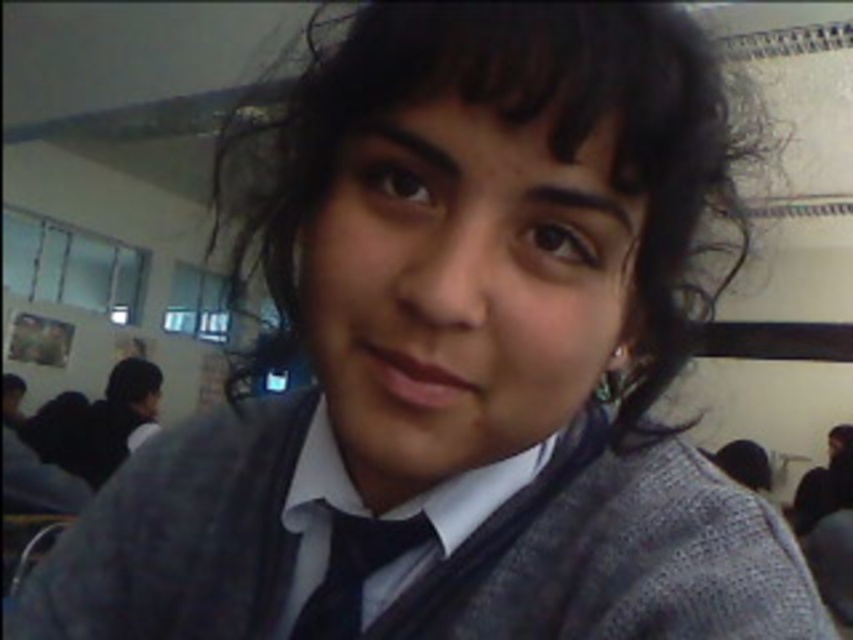
Question: Which object appears closest to the camera in this image?

Choices:
 (A) black satin tie at center
 (B) dark brown silky hair at center
 (C) matte gray sweater at center

Answer: (B)

Question: Which point is closer to the camera taking this photo?

Choices:
 (A) (286, 216)
 (B) (685, 512)

Answer: (A)

Question: Does matte gray sweater at center lie in front of black satin tie at center?

Choices:
 (A) no
 (B) yes

Answer: (B)

Question: Is matte gray sweater at center to the right of black satin tie at center from the viewer's perspective?

Choices:
 (A) no
 (B) yes

Answer: (A)

Question: Based on their relative distances, which object is nearer to the dark brown silky hair at center?

Choices:
 (A) matte gray sweater at center
 (B) black satin tie at center

Answer: (A)

Question: Is matte gray sweater at center closer to the viewer compared to dark brown silky hair at center?

Choices:
 (A) no
 (B) yes

Answer: (A)